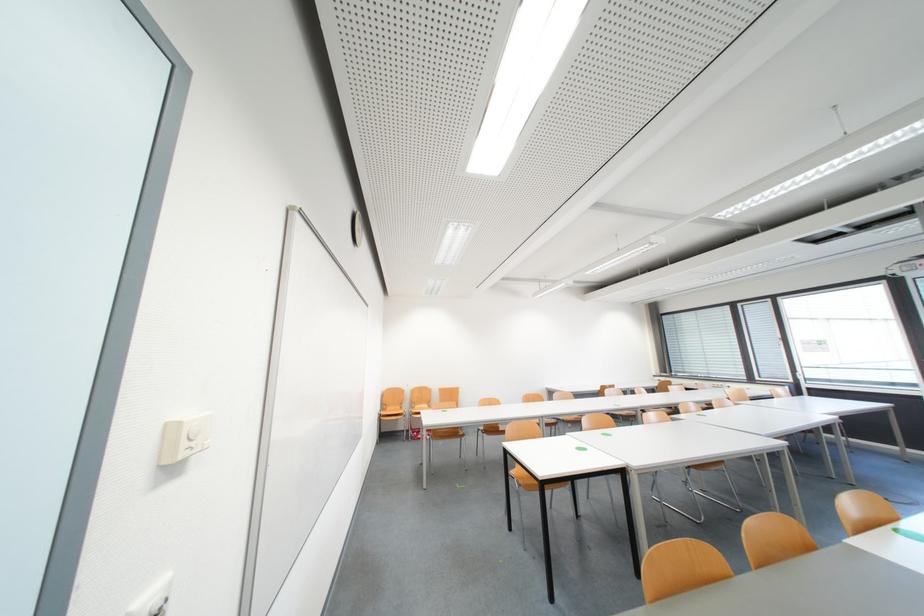
Find where to turn the white wall-mounted dial. Please return your answer as a coordinate pair (x, y).

(184, 438)